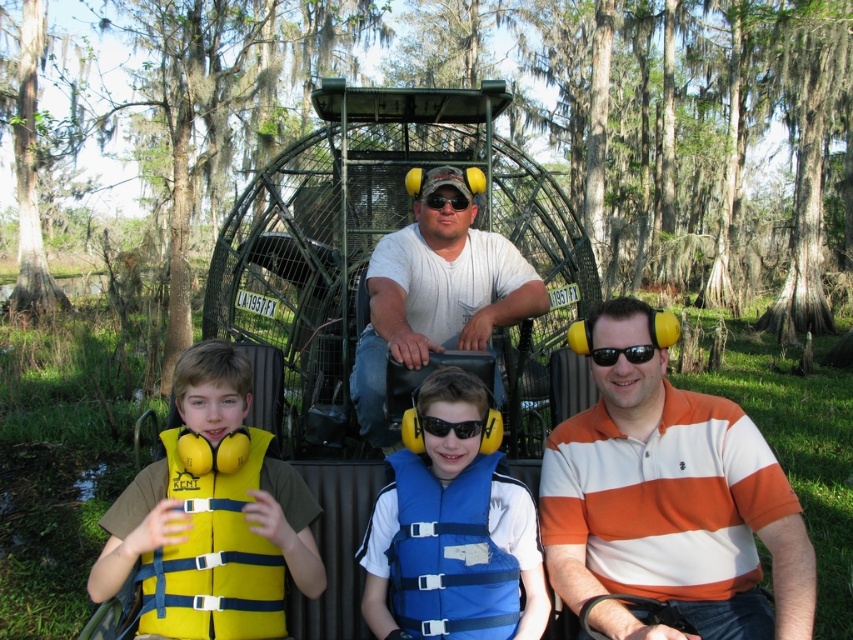
Question: Is yellow fabric life jacket at left further to camera compared to yellow foam ear protection at center?

Choices:
 (A) no
 (B) yes

Answer: (A)

Question: Which object is positioned closest to the black plastic sunglasses at center?

Choices:
 (A) blue life vest at center
 (B) black matte sunglasses at center
 (C) yellow foam ear protection at center
 (D) white matte shirt at center

Answer: (C)

Question: Does orange striped polo shirt at center appear on the right side of black matte sunglasses at center?

Choices:
 (A) no
 (B) yes

Answer: (B)

Question: Which of the following is the farthest from the observer?

Choices:
 (A) (650, 348)
 (B) (471, 428)
 (C) (225, 561)

Answer: (B)

Question: Which object is the farthest from the black matte sunglasses at center?

Choices:
 (A) white matte shirt at center
 (B) yellow foam ear protection at center
 (C) yellow fabric life jacket at left

Answer: (C)

Question: Does white matte shirt at center appear over yellow fabric life jacket at left?

Choices:
 (A) yes
 (B) no

Answer: (A)